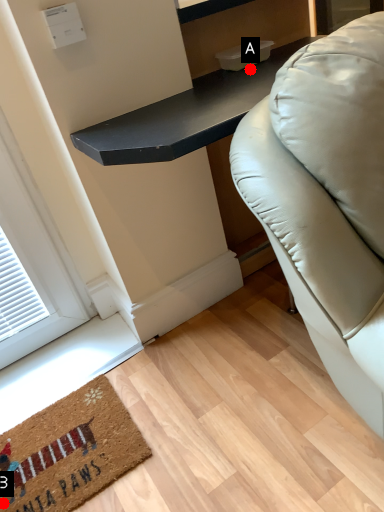
Question: Two points are circled on the image, labeled by A and B beside each circle. Which of the following is the farthest from the observer?

Choices:
 (A) A is further
 (B) B is further

Answer: (A)